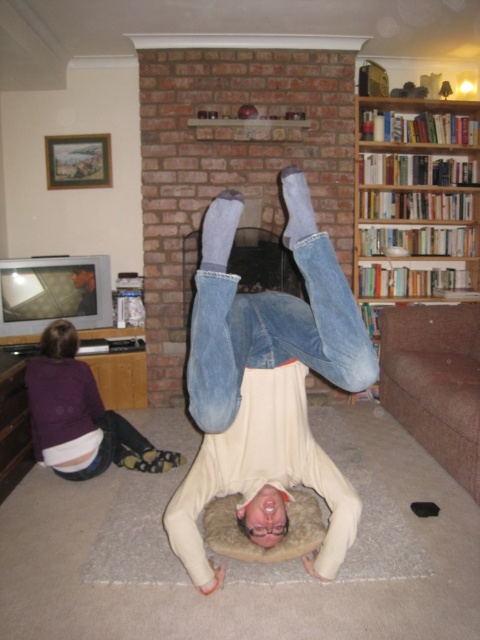
You are trying to place a small plant pot on the mantel shelf above the fireplace. The mantel shelf has limited space. The white cotton shirt at center is currently occupying some of that space. Is there enough space left on the mantel shelf to place the plant pot?

The white cotton shirt at center is located at point (266, 388), which does not directly indicate the available space on the mantel shelf. However, since the description mentions decorative items like a red spherical ornament and small objects possibly being books or trinkets, there might be limited space. Without exact measurements, it is uncertain if the plant pot will fit. Consider rearranging the existing items to make room.

You are organizing a clothing donation drive and need to determine which items can fit into a standard donation box that accommodates garments up to 30 inches in width. Based on the scene, can both the white cotton shirt at center and the purple fleece sweater at lower left be placed in the box?

The white cotton shirt at center has a lesser width compared to purple fleece sweater at lower left. Since the donation box can hold garments up to 30 inches, the white cotton shirt at center will fit, but the purple fleece sweater at lower left may exceed the width limit and might not fit.

You are a delivery person trying to place a package between the white cotton shirt at center and the purple fleece sweater at lower left. The package is 1.2 meters long. Can you fit it between them without moving either item?

The distance between the white cotton shirt at center and the purple fleece sweater at lower left is 1.11 meters. Since the package is 1.2 meters long, it cannot fit between them without moving either item.